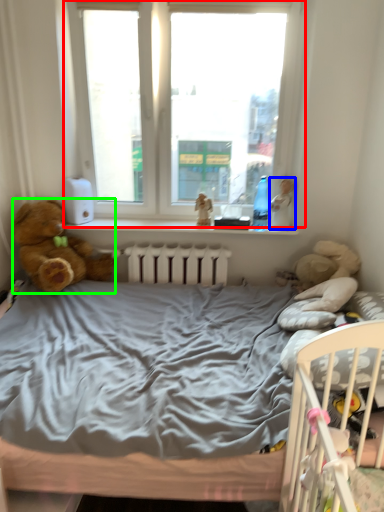
Question: Which object is positioned closest to window (highlighted by a red box)? Select from doll (highlighted by a blue box) and teddy bear (highlighted by a green box).

Choices:
 (A) doll
 (B) teddy bear

Answer: (A)